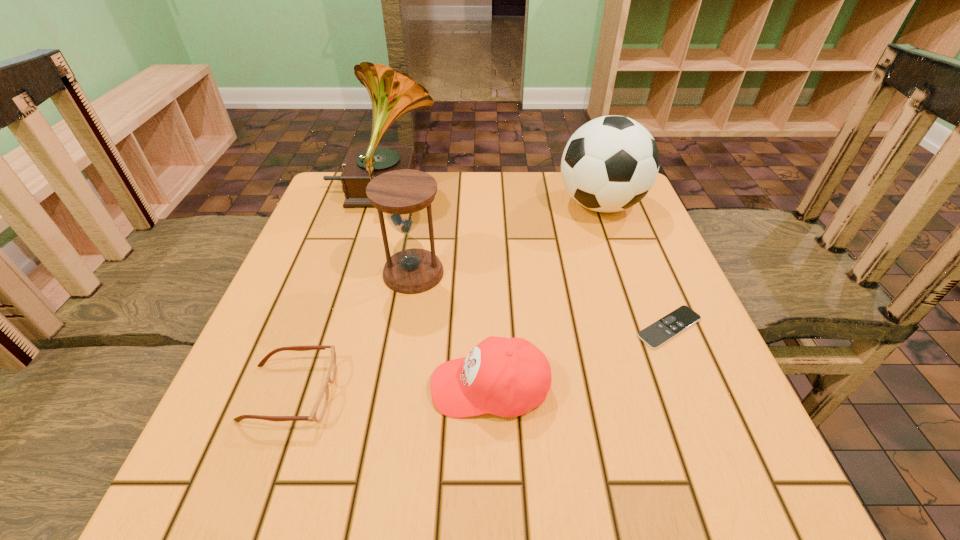
This screenshot has height=540, width=960. Find the location of `vacant space located 0.310m on the front panel of the third shortest object`. vacant space located 0.310m on the front panel of the third shortest object is located at coordinates (245, 387).

This screenshot has height=540, width=960. In order to click on vacant area located 0.280m on the front panel of the third shortest object in this screenshot , I will do `click(263, 387)`.

Locate an element on the screen. This screenshot has height=540, width=960. vacant space situated on the front panel of the third shortest object is located at coordinates click(x=377, y=387).

Identify the location of free space located on the front-facing side of the spectacles. (425, 393).

I want to click on vacant region located 0.400m on the back of the remote control, so click(x=615, y=196).

Find the location of a particular element. This screenshot has height=540, width=960. phonograph record at the far edge is located at coordinates pyautogui.click(x=392, y=93).

The height and width of the screenshot is (540, 960). Find the location of `soccer ball at the far edge`. soccer ball at the far edge is located at coordinates (609, 164).

The image size is (960, 540). In order to click on phonograph record that is at the left edge in this screenshot , I will do `click(392, 93)`.

The image size is (960, 540). I want to click on spectacles located at the left edge, so (318, 411).

The width and height of the screenshot is (960, 540). Find the location of `soccer ball that is at the right edge`. soccer ball that is at the right edge is located at coordinates (609, 164).